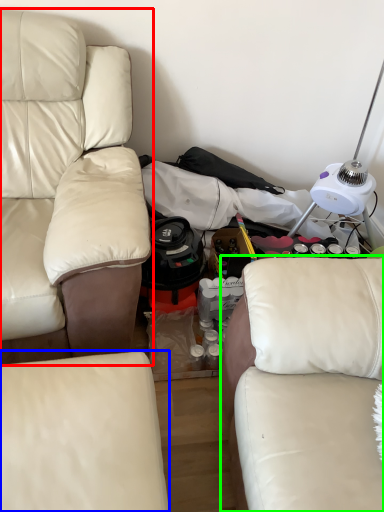
Question: Which is farther away from studio couch (highlighted by a red box)? studio couch (highlighted by a blue box) or studio couch (highlighted by a green box)?

Choices:
 (A) studio couch
 (B) studio couch

Answer: (B)